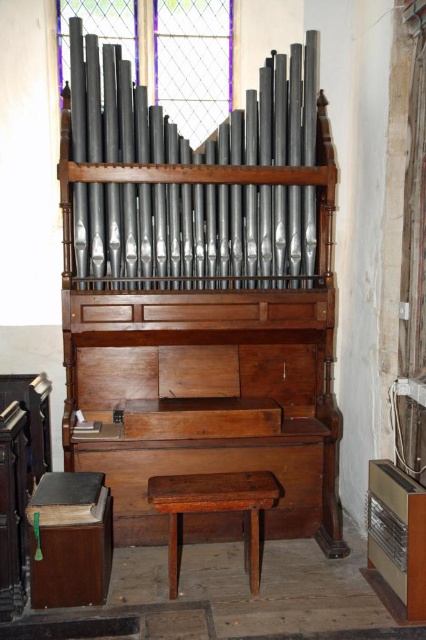
Question: Which point is farther to the camera?

Choices:
 (A) dark brown wood stool at center
 (B) matte black pipes at center

Answer: (B)

Question: Does matte black pipes at center lie in front of dark brown wood stool at center?

Choices:
 (A) no
 (B) yes

Answer: (A)

Question: Does matte black pipes at center appear on the left side of dark brown wood stool at center?

Choices:
 (A) no
 (B) yes

Answer: (B)

Question: Is the position of matte black pipes at center less distant than that of dark brown wood stool at center?

Choices:
 (A) yes
 (B) no

Answer: (B)

Question: Among these points, which one is nearest to the camera?

Choices:
 (A) (166, 496)
 (B) (235, 230)

Answer: (A)